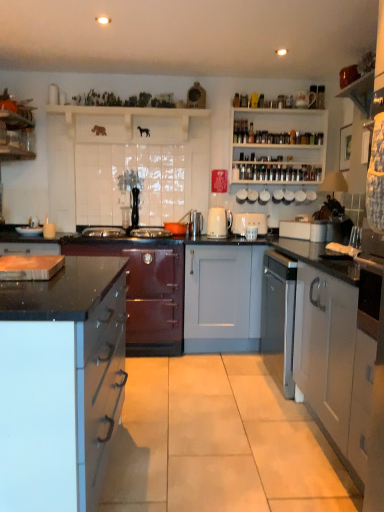
Measure the distance between point (275, 200) and camera.

They are 3.67 meters apart.

What do you see at coordinates (278, 145) in the screenshot?
I see `white wooden shelves at upper right, which is counted as the 2th shelf, starting from the left` at bounding box center [278, 145].

Describe the element at coordinates (249, 223) in the screenshot. I see `white matte toaster at center, acting as the third appliance starting from the left` at that location.

Locate an element on the screen. The height and width of the screenshot is (512, 384). white matte toaster at center, acting as the third appliance starting from the left is located at coordinates click(x=249, y=223).

This screenshot has height=512, width=384. Describe the element at coordinates (241, 196) in the screenshot. I see `white ceramic mug at upper center, the 4th appliance positioned from the right` at that location.

Consider the image. In order to face white wooden shelf at upper center, which ranks as the second shelf in right-to-left order, should I rotate leftwards or rightwards?

Rotate your view left by about 8.303°.

Image resolution: width=384 pixels, height=512 pixels. Describe the element at coordinates (147, 292) in the screenshot. I see `shiny burgundy cabinet at center-left, the first cabinetry positioned from the back` at that location.

This screenshot has height=512, width=384. Describe the element at coordinates (252, 195) in the screenshot. I see `white ceramic kettle at upper center, the fourth appliance viewed from the left` at that location.

Where is `white ceramic cup at upper center, the first appliance in the right-to-left sequence`? The height and width of the screenshot is (512, 384). white ceramic cup at upper center, the first appliance in the right-to-left sequence is located at coordinates (278, 196).

Is point (88, 432) positioned after point (250, 219)?

No, (88, 432) is closer to viewer.

Is white glossy cabinet at lower left, which ranks as the third cabinetry in back-to-front order, positioned beyond the bounds of white matte toaster at center, the third appliance in the right-to-left sequence?

Absolutely, white glossy cabinet at lower left, which ranks as the third cabinetry in back-to-front order, is external to white matte toaster at center, the third appliance in the right-to-left sequence.

From the image's perspective, is white glossy cabinet at lower left, the first cabinetry viewed from the front, over white matte toaster at center, the third appliance in the right-to-left sequence?

No.

In the scene shown: Considering the sizes of white glossy cabinet at lower left, the first cabinetry viewed from the front, and white matte toaster at center, acting as the third appliance starting from the left, in the image, is white glossy cabinet at lower left, the first cabinetry viewed from the front, taller or shorter than white matte toaster at center, acting as the third appliance starting from the left,?

white glossy cabinet at lower left, the first cabinetry viewed from the front, is taller than white matte toaster at center, acting as the third appliance starting from the left.

Between white glossy cabinet at lower left, which is counted as the first cabinetry, starting from the left, and white ceramic kettle at upper center, which is the 2th appliance from right to left, which one has smaller size?

white ceramic kettle at upper center, which is the 2th appliance from right to left.

Is point (111, 373) in front of point (254, 196)?

That is True.

Is white glossy cabinet at lower left, which ranks as the third cabinetry in back-to-front order, to the right of white ceramic kettle at upper center, which is the 2th appliance from right to left, from the viewer's perspective?

No.

Between white ceramic mug at upper center, marked as the 2th appliance in a left-to-right arrangement, and white wooden shelves at upper right, which is counted as the 2th shelf, starting from the left, which one has smaller size?

white ceramic mug at upper center, marked as the 2th appliance in a left-to-right arrangement.

From a real-world perspective, which is physically above, white ceramic mug at upper center, marked as the 2th appliance in a left-to-right arrangement, or white wooden shelves at upper right, which is counted as the 2th shelf, starting from the left?

white wooden shelves at upper right, which is counted as the 2th shelf, starting from the left, is physically above.

Considering the relative positions of white ceramic mug at upper center, marked as the 2th appliance in a left-to-right arrangement, and white wooden shelves at upper right, which is counted as the 2th shelf, starting from the left, in the image provided, is white ceramic mug at upper center, marked as the 2th appliance in a left-to-right arrangement, in front of white wooden shelves at upper right, which is counted as the 2th shelf, starting from the left,?

That is False.

Could you tell me if white ceramic mug at upper center, marked as the 2th appliance in a left-to-right arrangement, is turned towards white wooden shelves at upper right, which ranks as the 1th shelf in right-to-left order?

No, white ceramic mug at upper center, marked as the 2th appliance in a left-to-right arrangement, is not oriented towards white wooden shelves at upper right, which ranks as the 1th shelf in right-to-left order.

From a real-world perspective, count 3rd cabinetrys downward from the white ceramic cup at upper center, the first appliance in the right-to-left sequence, and point to it. Please provide its 2D coordinates.

[(60, 382)]

Can you confirm if white ceramic cup at upper center, the first appliance in the right-to-left sequence, is smaller than white glossy cabinet at lower left, the third cabinetry from the right?

Correct, white ceramic cup at upper center, the first appliance in the right-to-left sequence, occupies less space than white glossy cabinet at lower left, the third cabinetry from the right.

Which is more to the left, white ceramic cup at upper center, the first appliance in the right-to-left sequence, or white glossy cabinet at lower left, which is counted as the first cabinetry, starting from the left?

From the viewer's perspective, white glossy cabinet at lower left, which is counted as the first cabinetry, starting from the left, appears more on the left side.

Considering the points (280, 200) and (16, 387), which point is behind, point (280, 200) or point (16, 387)?

Positioned behind is point (280, 200).

Image resolution: width=384 pixels, height=512 pixels. In order to click on the 2nd appliance above the white glossy cabinet at lower left, the first cabinetry viewed from the front (from the image's perspective) in this screenshot , I will do `click(219, 222)`.

Who is taller, white glossy kettle at center, the 5th appliance positioned from the right, or white glossy cabinet at lower left, the first cabinetry viewed from the front?

With more height is white glossy cabinet at lower left, the first cabinetry viewed from the front.

Would you say white glossy kettle at center, the first appliance in the left-to-right sequence, is to the left or to the right of white glossy cabinet at lower left, which ranks as the third cabinetry in back-to-front order, in the picture?

white glossy kettle at center, the first appliance in the left-to-right sequence, is positioned on white glossy cabinet at lower left, which ranks as the third cabinetry in back-to-front order,'s right side.

Looking at the image, does shiny burgundy cabinet at center-left, the second cabinetry positioned from the left, seem bigger or smaller compared to white matte cabinet at right, acting as the first cabinetry starting from the right?

Considering their sizes, shiny burgundy cabinet at center-left, the second cabinetry positioned from the left, takes up more space than white matte cabinet at right, acting as the first cabinetry starting from the right.

I want to click on cabinetry on the right of shiny burgundy cabinet at center-left, placed as the 3th cabinetry when sorted from front to back, so click(325, 347).

Can you confirm if shiny burgundy cabinet at center-left, which appears as the second cabinetry when viewed from the right, is shorter than white matte cabinet at right, acting as the first cabinetry starting from the right?

No.

How many degrees apart are the facing directions of shiny burgundy cabinet at center-left, placed as the 3th cabinetry when sorted from front to back, and white matte cabinet at right, which is the second cabinetry from back to front?

They differ by 89.4 degrees in their facing directions.

From the image's perspective, which is above, white matte cabinet at right, which is the 3th cabinetry in left-to-right order, or shiny burgundy cabinet at center-left, the first cabinetry positioned from the back?

From the image's view, shiny burgundy cabinet at center-left, the first cabinetry positioned from the back, is above.

Between white matte cabinet at right, the second cabinetry when ordered from front to back, and shiny burgundy cabinet at center-left, the second cabinetry positioned from the left, which one appears on the right side from the viewer's perspective?

Positioned to the right is white matte cabinet at right, the second cabinetry when ordered from front to back.

Is point (309, 380) closer to viewer compared to point (141, 353)?

Yes, point (309, 380) is closer to viewer.

At what (x,y) coordinates should I click in order to perform the action: click on appliance that is the 2nd one when counting backward from the white glossy cabinet at lower left, the third cabinetry from the right. Please return your answer as a coordinate pair (x, y). Image resolution: width=384 pixels, height=512 pixels. Looking at the image, I should click on (249, 223).

The height and width of the screenshot is (512, 384). Find the location of `the 2nd cabinetry counting from the left side of the white ceramic kettle at upper center, the fourth appliance viewed from the left`. the 2nd cabinetry counting from the left side of the white ceramic kettle at upper center, the fourth appliance viewed from the left is located at coordinates (60, 382).

Considering their positions, is white matte cabinet at right, which is the 3th cabinetry in left-to-right order, positioned further to shiny burgundy cabinet at center-left, the first cabinetry positioned from the back, than white ceramic mug at upper center, marked as the 2th appliance in a left-to-right arrangement?

white matte cabinet at right, which is the 3th cabinetry in left-to-right order, lies further to shiny burgundy cabinet at center-left, the first cabinetry positioned from the back, than the other object.

Considering their positions, is white ceramic mug at upper center, the 4th appliance positioned from the right, positioned closer to white wooden shelf at upper center, which is counted as the first shelf, starting from the left, than white glossy kettle at center, the first appliance in the left-to-right sequence?

white glossy kettle at center, the first appliance in the left-to-right sequence.

When comparing their distances from white ceramic mug at upper center, marked as the 2th appliance in a left-to-right arrangement, does white glossy kettle at center, the 5th appliance positioned from the right, or shiny burgundy cabinet at center-left, the second cabinetry positioned from the left, seem closer?

Based on the image, white glossy kettle at center, the 5th appliance positioned from the right, appears to be nearer to white ceramic mug at upper center, marked as the 2th appliance in a left-to-right arrangement.

Looking at the image, which one is located closer to white glossy kettle at center, the first appliance in the left-to-right sequence, white ceramic cup at upper center, the first appliance in the right-to-left sequence, or white ceramic kettle at upper center, the fourth appliance viewed from the left?

white ceramic kettle at upper center, the fourth appliance viewed from the left, is closer to white glossy kettle at center, the first appliance in the left-to-right sequence.

Considering their positions, is white ceramic mug at upper center, the 4th appliance positioned from the right, positioned further to white wooden shelf at upper center, which ranks as the second shelf in right-to-left order, than white wooden shelves at upper right, which ranks as the 1th shelf in right-to-left order?

white ceramic mug at upper center, the 4th appliance positioned from the right, is positioned further to the anchor white wooden shelf at upper center, which ranks as the second shelf in right-to-left order.

Based on their spatial positions, is white glossy kettle at center, the first appliance in the left-to-right sequence, or white ceramic cup at upper center, which appears as the fifth appliance when viewed from the left, closer to white wooden shelves at upper right, which ranks as the 1th shelf in right-to-left order?

white ceramic cup at upper center, which appears as the fifth appliance when viewed from the left.

Considering their positions, is white glossy kettle at center, the 5th appliance positioned from the right, positioned further to white wooden shelf at upper center, which is counted as the first shelf, starting from the left, than white ceramic cup at upper center, the first appliance in the right-to-left sequence?

white ceramic cup at upper center, the first appliance in the right-to-left sequence, is positioned further to the anchor white wooden shelf at upper center, which is counted as the first shelf, starting from the left.

Considering their positions, is shiny burgundy cabinet at center-left, the second cabinetry positioned from the left, positioned closer to white matte cabinet at right, the second cabinetry when ordered from front to back, than white wooden shelves at upper right, which ranks as the 1th shelf in right-to-left order?

shiny burgundy cabinet at center-left, the second cabinetry positioned from the left, is closer to white matte cabinet at right, the second cabinetry when ordered from front to back.

In order to click on cabinetry between white matte cabinet at right, which is the 3th cabinetry in left-to-right order, and white glossy kettle at center, the 5th appliance positioned from the right, along the z-axis in this screenshot , I will do `click(147, 292)`.

The image size is (384, 512). What are the coordinates of `shelf between white matte cabinet at right, the second cabinetry when ordered from front to back, and white matte toaster at center, the third appliance in the right-to-left sequence, in the front-back direction` in the screenshot? It's located at (127, 123).

Identify the location of cabinetry between white matte cabinet at right, which is the 3th cabinetry in left-to-right order, and white wooden shelves at upper right, which is counted as the 2th shelf, starting from the left, from front to back. (147, 292).

This screenshot has width=384, height=512. What are the coordinates of `cabinetry located between white matte cabinet at right, which is the 3th cabinetry in left-to-right order, and white ceramic mug at upper center, the 4th appliance positioned from the right, in the depth direction` in the screenshot? It's located at (147, 292).